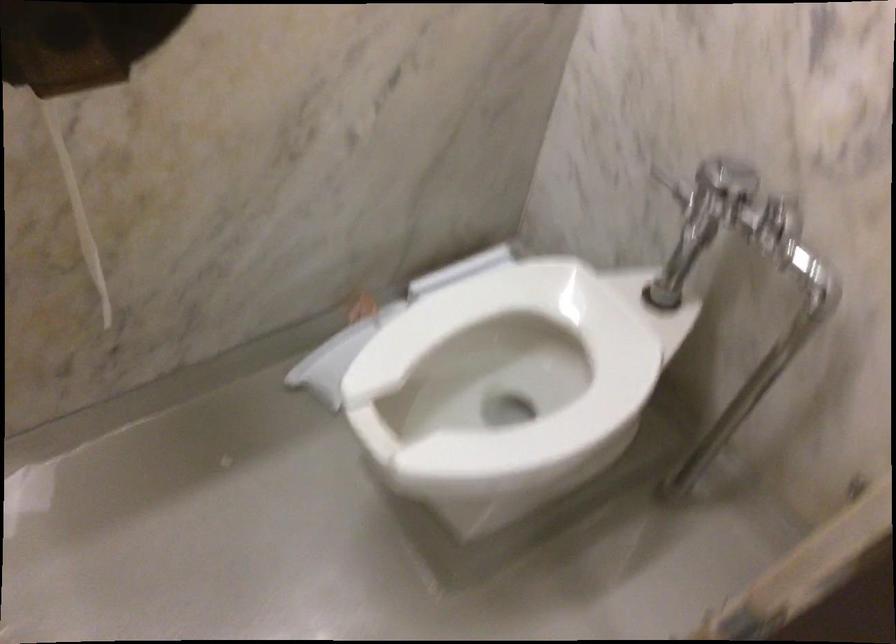
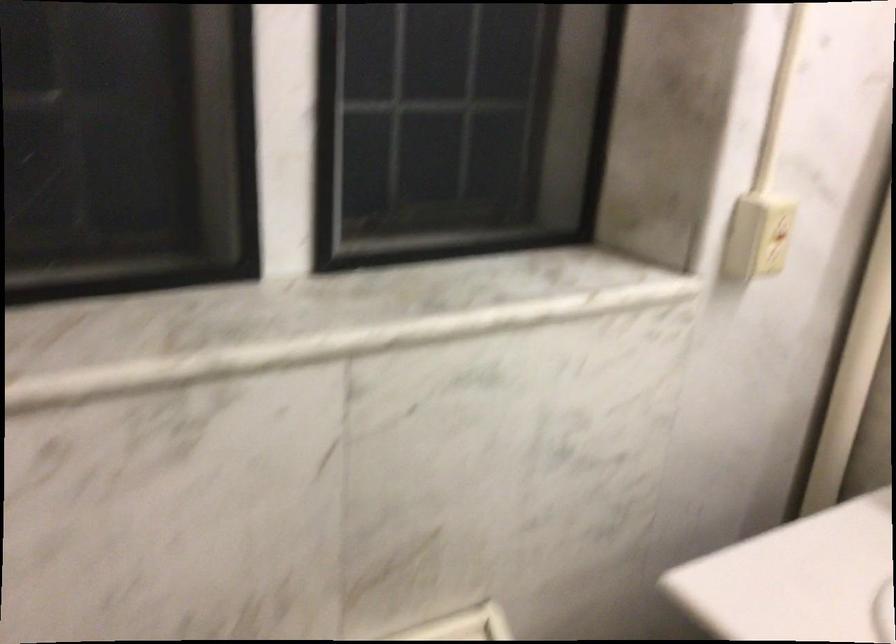
The images are taken continuously from a first-person perspective. In which direction is your viewpoint rotating?

The rotation direction of the camera is right-down.